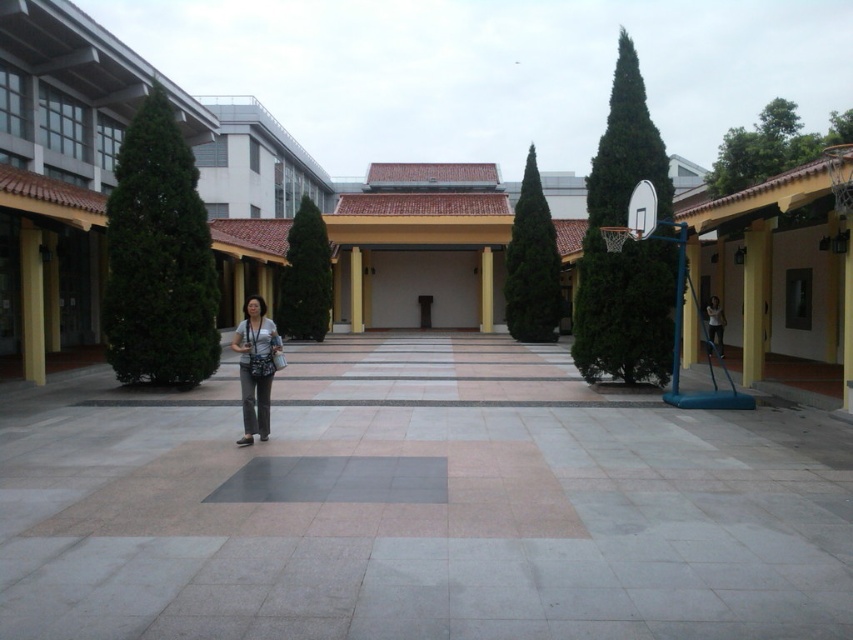
You are standing at point (32, 301) in the courtyard. What object is located exactly at your current position?

The yellow matte pillar at left is located exactly at point (32, 301).

You are a city planner designing a new public space. You have to place a new bench in the gray concrete courtyard at center. Considering the size of the matte black camera at center, will the courtyard have enough space to accommodate the bench?

The gray concrete courtyard at center is larger in size than the matte black camera at center, so there should be sufficient space to place the bench within the courtyard.